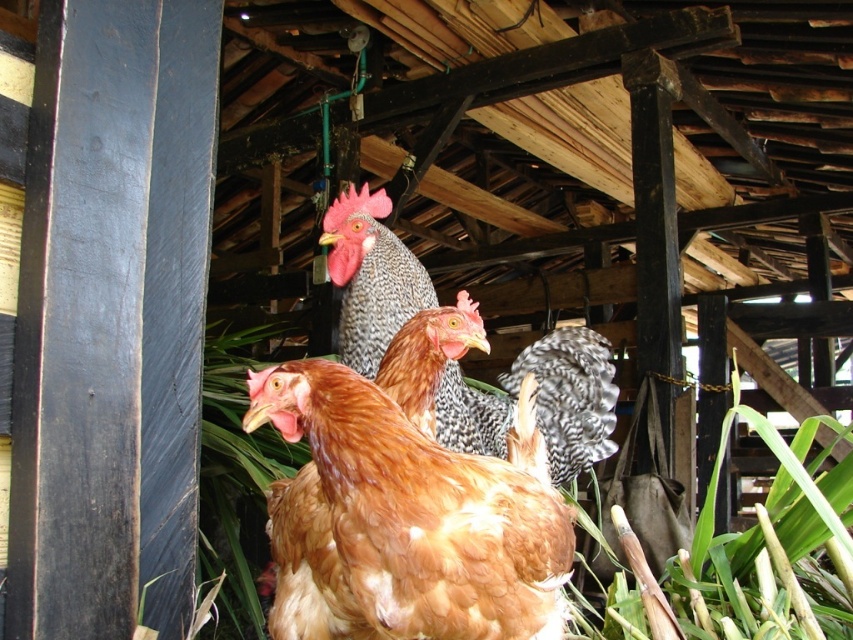
Does brown feathered chicken at center have a greater height compared to speckled feathered rooster at center?

Correct, brown feathered chicken at center is much taller as speckled feathered rooster at center.

Between brown feathered chicken at center and speckled feathered rooster at center, which one is positioned higher?

speckled feathered rooster at center is higher up.

Where is `brown feathered chicken at center`? brown feathered chicken at center is located at coordinates (425, 509).

The width and height of the screenshot is (853, 640). Find the location of `brown feathered chicken at center`. brown feathered chicken at center is located at coordinates (425, 509).

Is the position of brown feathered chicken at center more distant than that of speckled feathered chicken at center?

No, brown feathered chicken at center is closer to the viewer.

Can you confirm if brown feathered chicken at center is smaller than speckled feathered chicken at center?

Actually, brown feathered chicken at center might be larger than speckled feathered chicken at center.

Describe the element at coordinates (425, 509) in the screenshot. Image resolution: width=853 pixels, height=640 pixels. I see `brown feathered chicken at center` at that location.

Identify the location of brown feathered chicken at center. The width and height of the screenshot is (853, 640). (425, 509).

Who is higher up, speckled feathered chicken at center or speckled feathered rooster at center?

speckled feathered rooster at center

Who is shorter, speckled feathered chicken at center or speckled feathered rooster at center?

With less height is speckled feathered chicken at center.

Who is more distant from viewer, (560, 348) or (329, 275)?

The point (329, 275) is more distant.

At what (x,y) coordinates should I click in order to perform the action: click on speckled feathered chicken at center. Please return your answer as a coordinate pair (x, y). Image resolution: width=853 pixels, height=640 pixels. Looking at the image, I should click on (560, 400).